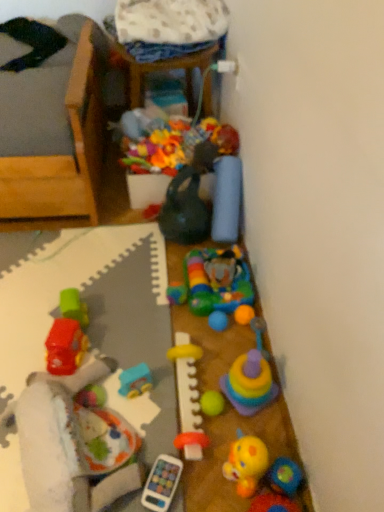
Question: Which direction should I rotate to look at matte green kettle at center, marked as the ninth toy in a right-to-left arrangement?

Choices:
 (A) right
 (B) left

Answer: (B)

Question: Can you confirm if yellow rubber teething ring at center, the 4th toy from the left, is taller than rubberized yellow duck at lower right, which is the eleventh toy from left to right?

Choices:
 (A) yes
 (B) no

Answer: (B)

Question: Is rubberized yellow duck at lower right, which is the eleventh toy from left to right, a part of yellow rubber teething ring at center, the 4th toy from the left?

Choices:
 (A) yes
 (B) no

Answer: (B)

Question: Considering the relative positions of yellow rubber teething ring at center, positioned as the eighth toy in right-to-left order, and rubberized yellow duck at lower right, which is counted as the first toy, starting from the right, in the image provided, is yellow rubber teething ring at center, positioned as the eighth toy in right-to-left order, behind rubberized yellow duck at lower right, which is counted as the first toy, starting from the right,?

Choices:
 (A) no
 (B) yes

Answer: (B)

Question: Does yellow rubber teething ring at center, the 4th toy from the left, have a greater width compared to rubberized yellow duck at lower right, which is counted as the first toy, starting from the right?

Choices:
 (A) yes
 (B) no

Answer: (B)

Question: Is yellow rubber teething ring at center, positioned as the eighth toy in right-to-left order, positioned before rubberized yellow duck at lower right, which is counted as the first toy, starting from the right?

Choices:
 (A) yes
 (B) no

Answer: (B)

Question: From a real-world perspective, is yellow rubber teething ring at center, positioned as the eighth toy in right-to-left order, physically below rubberized yellow duck at lower right, which is counted as the first toy, starting from the right?

Choices:
 (A) yes
 (B) no

Answer: (A)

Question: Considering the relative sizes of blue plastic toy car at center, which is the second toy from left to right, and rubberized plastic elephant at center, the 6th toy when ordered from left to right, in the image provided, is blue plastic toy car at center, which is the second toy from left to right, bigger than rubberized plastic elephant at center, the 6th toy when ordered from left to right,?

Choices:
 (A) yes
 (B) no

Answer: (B)

Question: From the image's perspective, is blue plastic toy car at center, which is the second toy from left to right, on top of rubberized plastic elephant at center, marked as the 6th toy in a right-to-left arrangement?

Choices:
 (A) yes
 (B) no

Answer: (B)

Question: From the image's perspective, does blue plastic toy car at center, which is the second toy from left to right, appear lower than rubberized plastic elephant at center, marked as the 6th toy in a right-to-left arrangement?

Choices:
 (A) yes
 (B) no

Answer: (A)

Question: Does blue plastic toy car at center, positioned as the tenth toy in right-to-left order, have a smaller size compared to rubberized plastic elephant at center, marked as the 6th toy in a right-to-left arrangement?

Choices:
 (A) yes
 (B) no

Answer: (A)

Question: Considering the relative positions of blue plastic toy car at center, which is the second toy from left to right, and rubberized plastic elephant at center, marked as the 6th toy in a right-to-left arrangement, in the image provided, is blue plastic toy car at center, which is the second toy from left to right, to the right of rubberized plastic elephant at center, marked as the 6th toy in a right-to-left arrangement, from the viewer's perspective?

Choices:
 (A) no
 (B) yes

Answer: (A)

Question: Does blue plastic toy car at center, positioned as the tenth toy in right-to-left order, turn towards rubberized plastic elephant at center, marked as the 6th toy in a right-to-left arrangement?

Choices:
 (A) yes
 (B) no

Answer: (B)

Question: Could you tell me if blue plastic toy car at center, positioned as the tenth toy in right-to-left order, is turned towards yellow rubber teething ring at center, positioned as the eighth toy in right-to-left order?

Choices:
 (A) yes
 (B) no

Answer: (B)